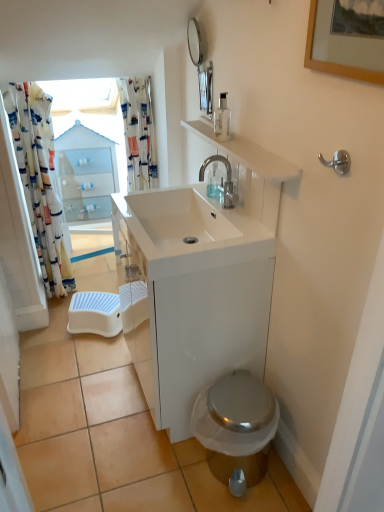
Identify the location of vacant space in between white glossy cabinet at center and shiny metallic toilet at lower right. The width and height of the screenshot is (384, 512). (197, 462).